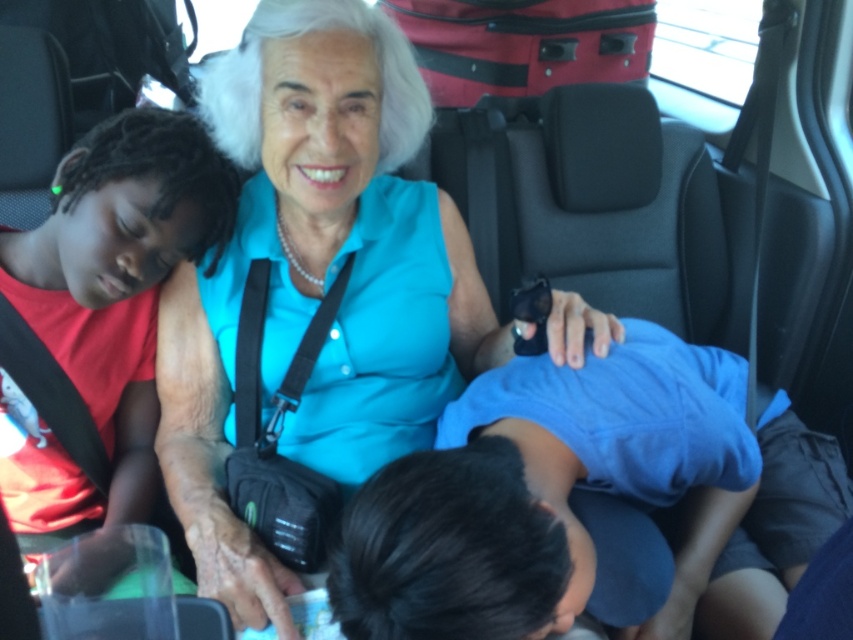
Between red cotton shirt at left and red fabric suitcase at upper center, which one appears on the left side from the viewer's perspective?

red cotton shirt at left is more to the left.

Between red cotton shirt at left and red fabric suitcase at upper center, which one has more height?

Standing taller between the two is red cotton shirt at left.

Is point (97, 138) in front of point (634, 12)?

Yes, point (97, 138) is in front of point (634, 12).

In order to click on red cotton shirt at left in this screenshot , I will do click(100, 317).

Is blue cotton shirt at center positioned at the back of red cotton shirt at left?

That is False.

Who is positioned more to the right, blue cotton shirt at center or red cotton shirt at left?

From the viewer's perspective, blue cotton shirt at center appears more on the right side.

Who is more distant from viewer, (485, 472) or (97, 378)?

Positioned behind is point (97, 378).

Locate an element on the screen. blue cotton shirt at center is located at coordinates (550, 484).

Does blue cotton shirt at center have a greater height compared to red fabric suitcase at upper center?

Yes, blue cotton shirt at center is taller than red fabric suitcase at upper center.

What are the coordinates of `blue cotton shirt at center` in the screenshot? It's located at (550, 484).